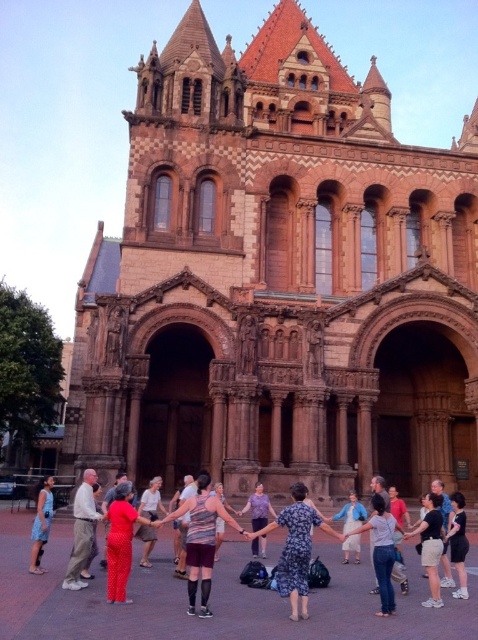
You are a photographer standing in front of the grand historic building. You want to capture a photo of both the floral dress at center and the blue denim dress at center. Which dress will appear wider in the photo?

The floral dress at center will appear wider in the photo because its width is larger than the blue denim dress at center.

You are standing in front of the grand historic building and see a point marked at coordinates (201, 540). What is located at that point?

The point at coordinates (201, 540) marks the location of the striped tank top at center.